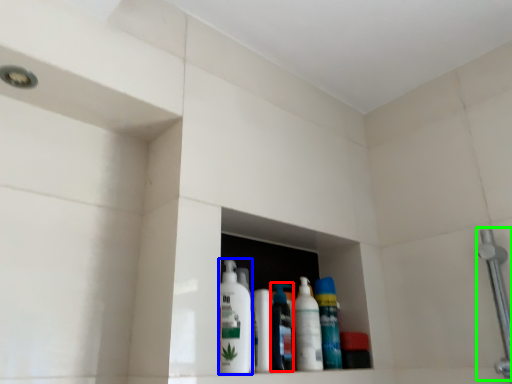
Question: Which is nearer to the cleaning product (highlighted by a red box)? cleaning product (highlighted by a blue box) or shower (highlighted by a green box).

Choices:
 (A) cleaning product
 (B) shower

Answer: (A)